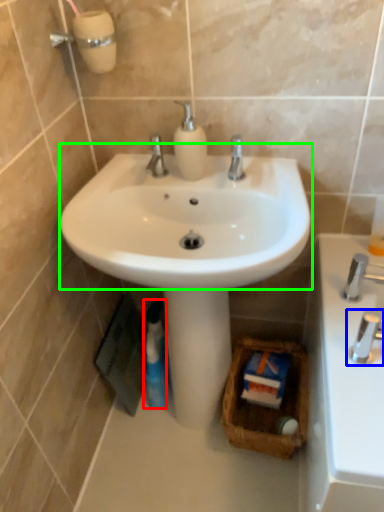
Question: Which object is the farthest from mouthwash (highlighted by a red box)? Choose among these: tap (highlighted by a blue box) or sink (highlighted by a green box).

Choices:
 (A) tap
 (B) sink

Answer: (A)